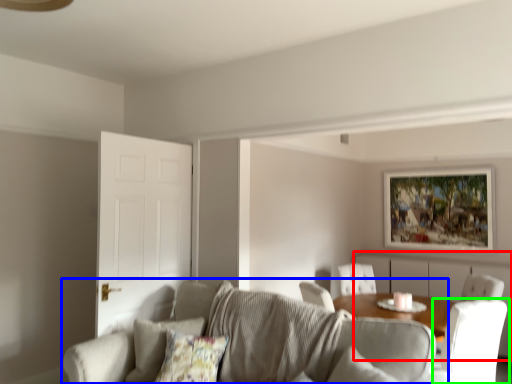
Question: Estimate the real-world distances between objects in this image. Which object is farther from dresser (highlighted by a red box), studio couch (highlighted by a blue box) or chair (highlighted by a green box)?

Choices:
 (A) studio couch
 (B) chair

Answer: (A)